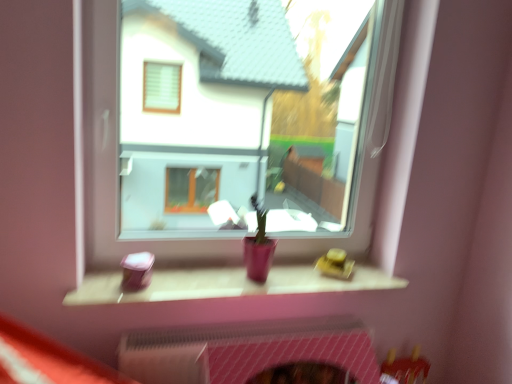
You are a GUI agent. You are given a task and a screenshot of the screen. Output one action in this format:
    pyautogui.click(x=<x>, y=<y>)
    Task: Click on the free spot above pink mesh fireplace at lower center (from a real-world perspective)
    The image size is (512, 384).
    Given the screenshot: What is the action you would take?
    pyautogui.click(x=202, y=338)